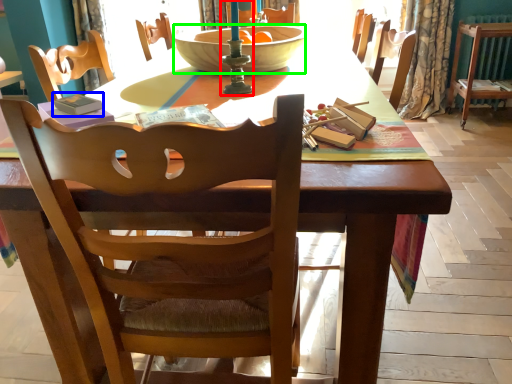
Question: Considering the real-world distances, which object is farthest from candle holder (highlighted by a red box)? paperback book (highlighted by a blue box) or bowl (highlighted by a green box)?

Choices:
 (A) paperback book
 (B) bowl

Answer: (A)